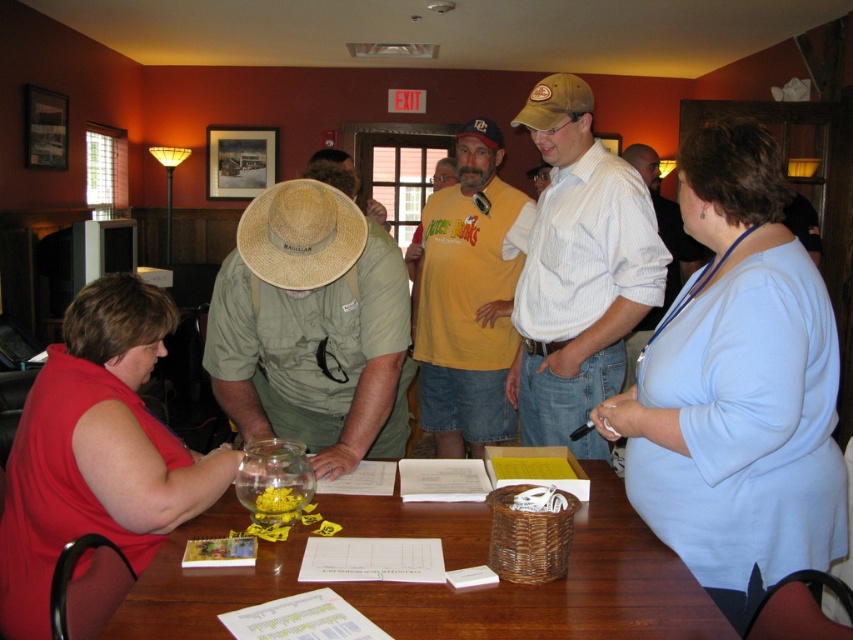
Question: Which point is closer to the camera?

Choices:
 (A) strawhat at center
 (B) brown canvas cowboy hat at upper center
 (C) light blue fabric shirt at upper right
 (D) matte red blouse at lower left

Answer: (C)

Question: Is light blue fabric shirt at upper right further to the viewer compared to strawhat at center?

Choices:
 (A) yes
 (B) no

Answer: (B)

Question: Which object is the farthest from the light blue fabric shirt at upper right?

Choices:
 (A) khaki cotton hat at center
 (B) white striped shirt at center

Answer: (A)

Question: Based on their relative distances, which object is nearer to the matte red blouse at lower left?

Choices:
 (A) white striped shirt at center
 (B) green canvas hat at center
 (C) wooden table at center

Answer: (B)

Question: Is wooden table at center to the right of white striped shirt at center from the viewer's perspective?

Choices:
 (A) no
 (B) yes

Answer: (A)

Question: Does light blue fabric shirt at upper right have a greater width compared to wooden table at center?

Choices:
 (A) yes
 (B) no

Answer: (B)